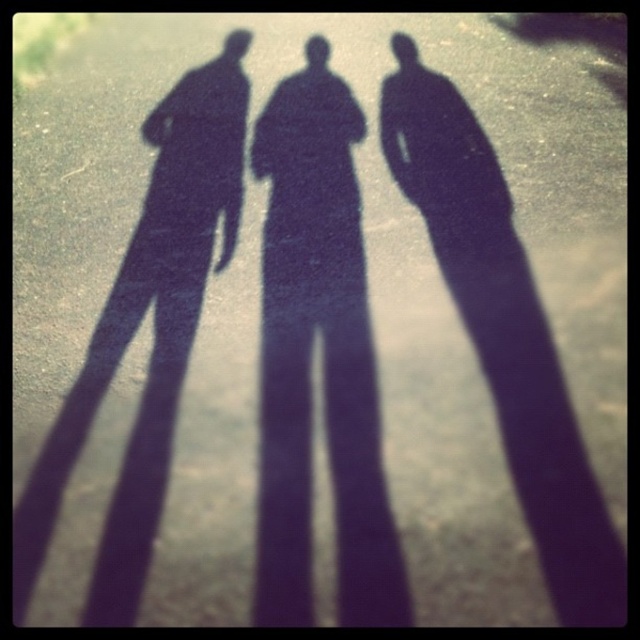
You are a security guard observing the scene. You notice the black matte shadow of a person at center and the black matte figure at left. Which one is covering the other?

The black matte shadow of a person at center is positioned over the black matte figure at left, so it is covering it.

You are standing on the paved area and want to walk from the black matte figure at left to the black matte figure at center. Is there any obstruction between them?

The black matte figure at center is positioned under the black matte figure at left, so there is an obstruction between them.